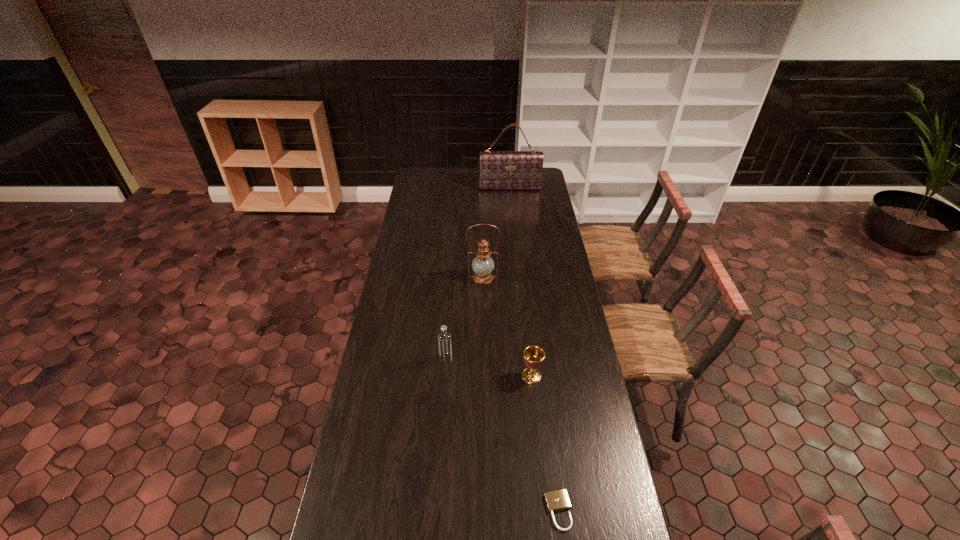
This screenshot has height=540, width=960. I want to click on free space at the left edge, so click(x=403, y=260).

The width and height of the screenshot is (960, 540). Identify the location of free space at the right edge. (536, 224).

You are a GUI agent. You are given a task and a screenshot of the screen. Output one action in this format:
    pyautogui.click(x=<x>, y=<y>)
    Task: Click on the free space at the far right corner of the desktop
    
    Given the screenshot: What is the action you would take?
    pyautogui.click(x=546, y=172)

At what (x,y) coordinates should I click in order to perform the action: click on free area in between the third nearest object and the fourth tallest object. Please return your answer as a coordinate pair (x, y). The height and width of the screenshot is (540, 960). Looking at the image, I should click on (489, 367).

Locate an element on the screen. This screenshot has width=960, height=540. free space between the second tallest object and the vodka is located at coordinates (465, 318).

At what (x,y) coordinates should I click in order to perform the action: click on empty location between the fourth shortest object and the tallest object. Please return your answer as a coordinate pair (x, y). Looking at the image, I should click on (496, 233).

Find the location of `free space between the second nearest object and the nearest object`. free space between the second nearest object and the nearest object is located at coordinates (545, 443).

Locate an element on the screen. empty space that is in between the vodka and the second shortest object is located at coordinates (489, 367).

Select which object is the closest to the nearest object. Please provide its 2D coordinates. Your answer should be formatted as a tuple, i.e. [(x, y)], where the tuple contains the x and y coordinates of a point satisfying the conditions above.

[(533, 355)]

The width and height of the screenshot is (960, 540). In order to click on the second closest object relative to the handbag in this screenshot , I will do `click(444, 339)`.